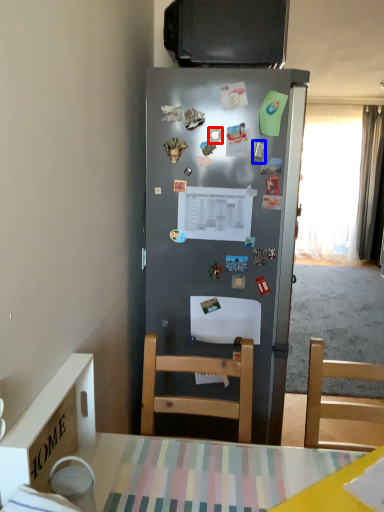
Question: Which point is closer to the camera, magnet (highlighted by a red box) or magnet (highlighted by a blue box)?

Choices:
 (A) magnet
 (B) magnet

Answer: (A)